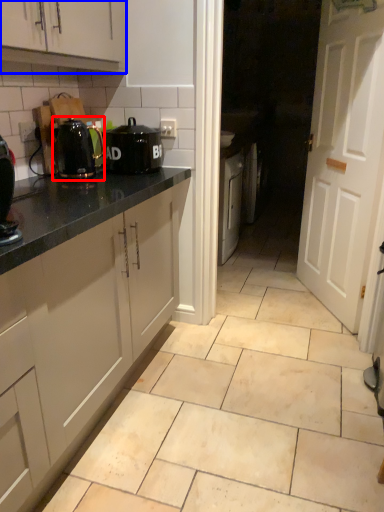
Question: Which object appears closest to the camera in this image, kitchen appliance (highlighted by a red box) or cabinetry (highlighted by a blue box)?

Choices:
 (A) kitchen appliance
 (B) cabinetry

Answer: (B)